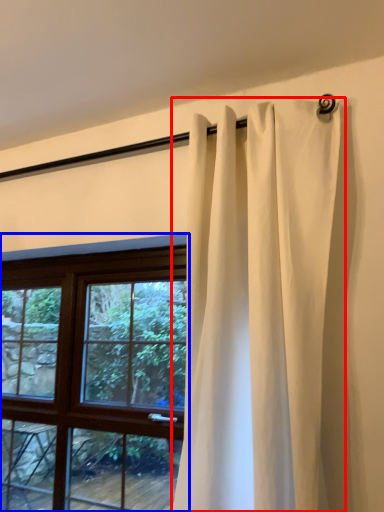
Question: Which point is closer to the camera, curtain (highlighted by a red box) or window (highlighted by a blue box)?

Choices:
 (A) curtain
 (B) window

Answer: (A)